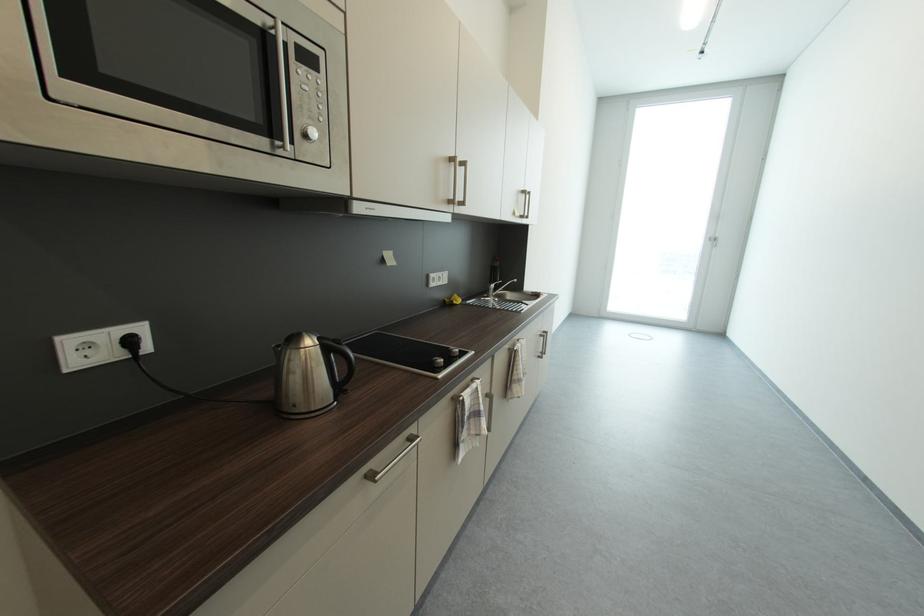
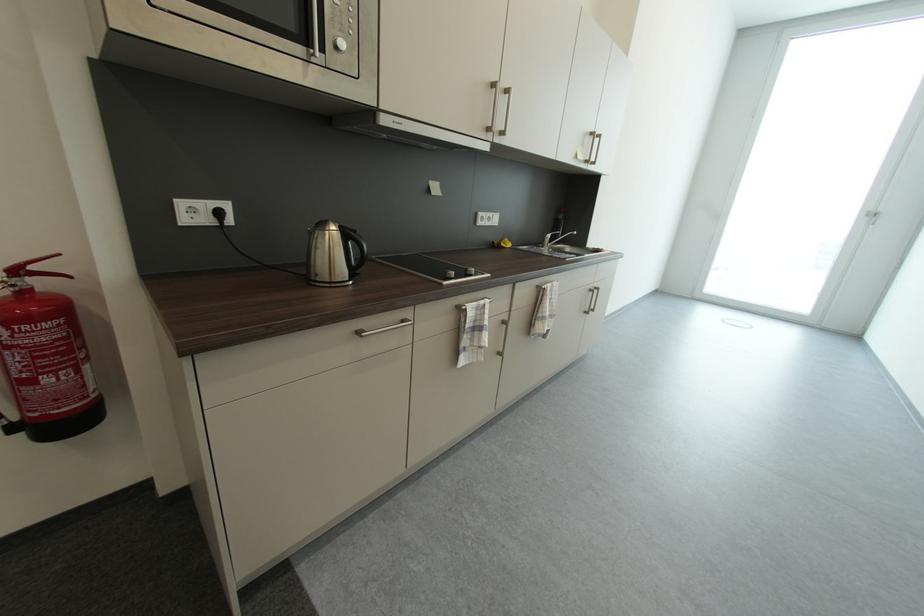
The point at (719,241) is marked in the first image. Where is the corresponding point in the second image?

(878, 217)